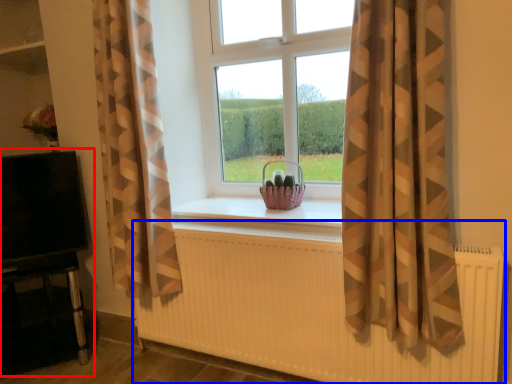
Question: Which object appears closest to the camera in this image, entertainment center (highlighted by a red box) or radiator (highlighted by a blue box)?

Choices:
 (A) entertainment center
 (B) radiator

Answer: (B)